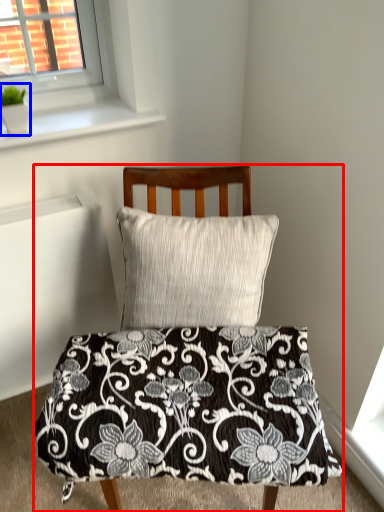
Question: Among these objects, which one is nearest to the camera, furniture (highlighted by a red box) or plant (highlighted by a blue box)?

Choices:
 (A) furniture
 (B) plant

Answer: (A)